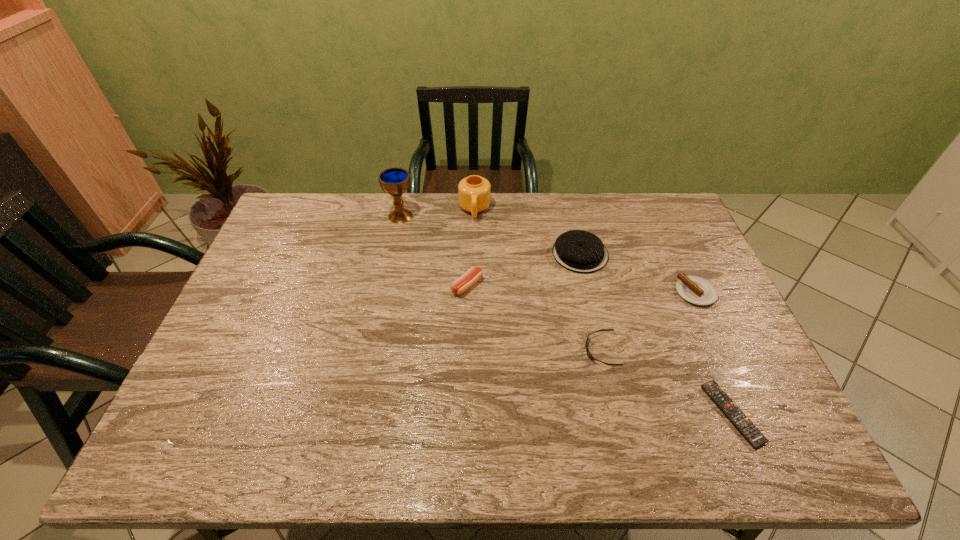
The height and width of the screenshot is (540, 960). Find the location of `free space at the right edge`. free space at the right edge is located at coordinates (669, 264).

In order to click on blank space at the far left corner of the desktop in this screenshot , I will do `click(301, 224)`.

In the image, there is a desktop. Identify the location of vacant space at the near left corner. (180, 429).

Image resolution: width=960 pixels, height=540 pixels. Find the location of `vacant space at the far right corner`. vacant space at the far right corner is located at coordinates (666, 193).

In order to click on free spot between the third shortest object and the shortest object in this screenshot , I will do `click(713, 353)`.

Locate an element on the screen. vacant point located between the sixth shortest object and the nearest object is located at coordinates (603, 312).

Locate an element on the screen. vacant area that lies between the mug and the pancake is located at coordinates (527, 232).

This screenshot has height=540, width=960. In order to click on vacant area that lies between the remote control and the shorter sausage in this screenshot , I will do pyautogui.click(x=713, y=353).

I want to click on vacant area between the sixth farthest object and the pancake, so click(x=590, y=302).

Find the location of a particular element. The image size is (960, 540). free spot between the second tallest object and the tallest object is located at coordinates (438, 213).